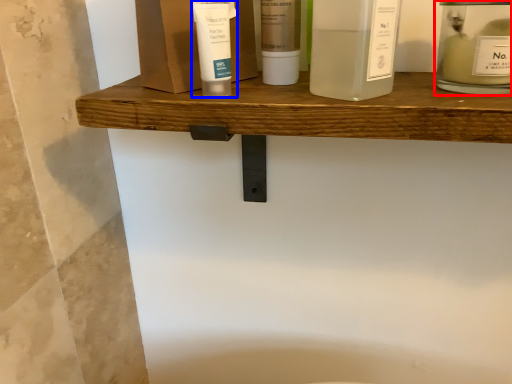
Question: Which object appears closest to the camera in this image, toiletry (highlighted by a red box) or toiletry (highlighted by a blue box)?

Choices:
 (A) toiletry
 (B) toiletry

Answer: (A)